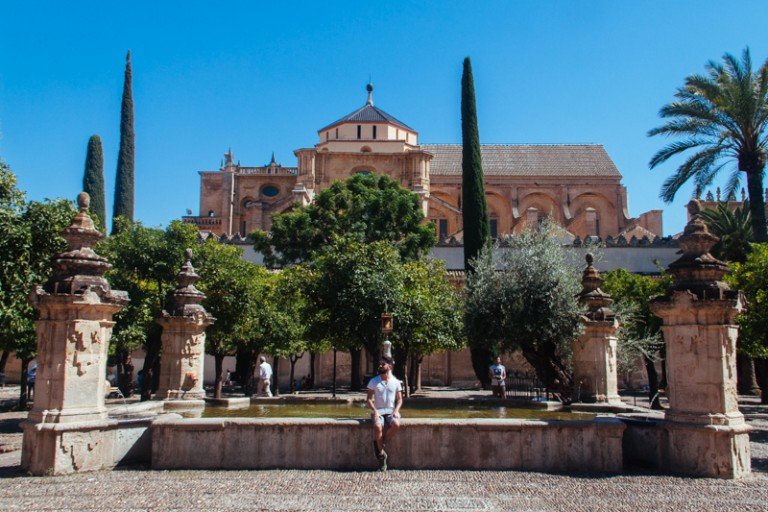
Where is `pillars`? pillars is located at coordinates (84, 385), (186, 354), (598, 354), (697, 362).